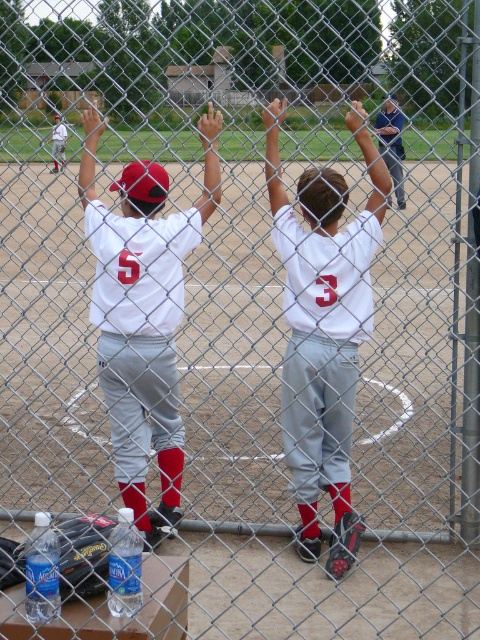
Based on the scene, what is the 2D coordinate of the white matte jersey at center?

The white matte jersey at center is located at the 2D coordinate point of (324, 330).